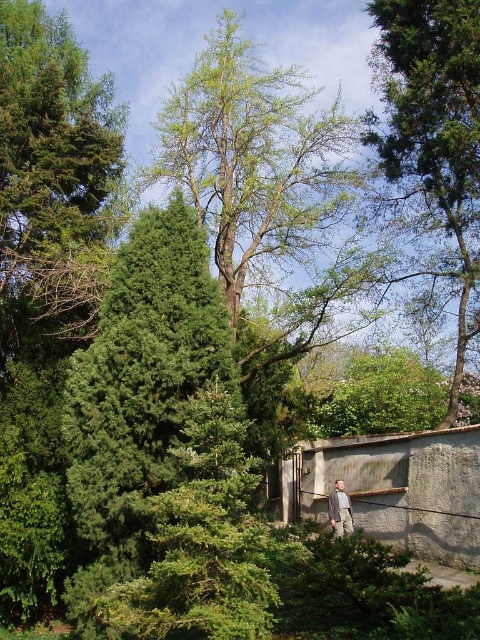
Question: Is green needle-like at upper left to the right of gray concrete wall at lower right from the viewer's perspective?

Choices:
 (A) no
 (B) yes

Answer: (A)

Question: Which point is closer to the camera?

Choices:
 (A) green leafy tree at upper center
 (B) green leafy tree at upper right
 (C) gray concrete wall at lower right
 (D) khaki fabric jacket at lower right

Answer: (C)

Question: Which point is closer to the camera?

Choices:
 (A) gray concrete wall at lower right
 (B) green leafy tree at upper right
 (C) green leafy tree at upper center
 (D) green needle-like at upper left

Answer: (A)

Question: Which object is farther from the camera taking this photo?

Choices:
 (A) gray concrete wall at lower right
 (B) green leafy tree at upper center

Answer: (B)

Question: Can you confirm if green leafy tree at upper center is thinner than khaki fabric jacket at lower right?

Choices:
 (A) yes
 (B) no

Answer: (B)

Question: Considering the relative positions of gray concrete wall at lower right and khaki fabric jacket at lower right in the image provided, where is gray concrete wall at lower right located with respect to khaki fabric jacket at lower right?

Choices:
 (A) below
 (B) above

Answer: (B)